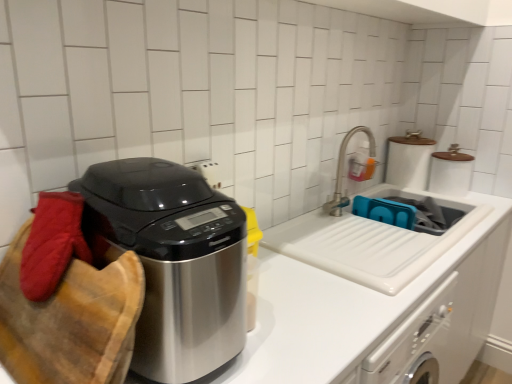
Locate an element on the screen. vacant space to the right of polished stainless steel appliance at left is located at coordinates (293, 336).